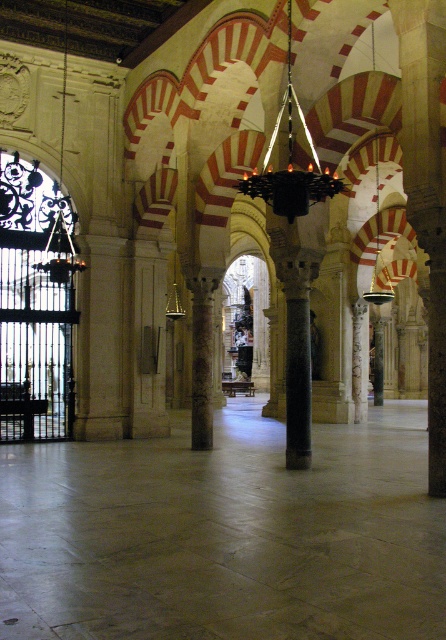
You are an interior designer planning to install a new lighting fixture in the grand historical building. You have a new black matte chandelier at center and a brown textured column at center. Which object takes up more space in the room?

The brown textured column at center occupies more space than the black matte chandelier at center.

You are standing in the grand historical building and want to take a photo of the point at coordinates point (289, 170). If your camera has a focal length of 50mm and you are 14.91 meters away from the point, what is the angle of view required to capture the point in the center of your photo?

The angle of view required to capture the point at coordinates point (289, 170) can be calculated using the formula angle of view in degrees equals 2 times arctangent of half the subject width divided by distance. However, since the point is a single coordinate without a width, the angle of view needed would depend on the camera sensor size and the desired framing. Alternatively, knowing the distance from the camera to the point is 14.91 meters, you can adjust the focal length or position to ensure the 0.